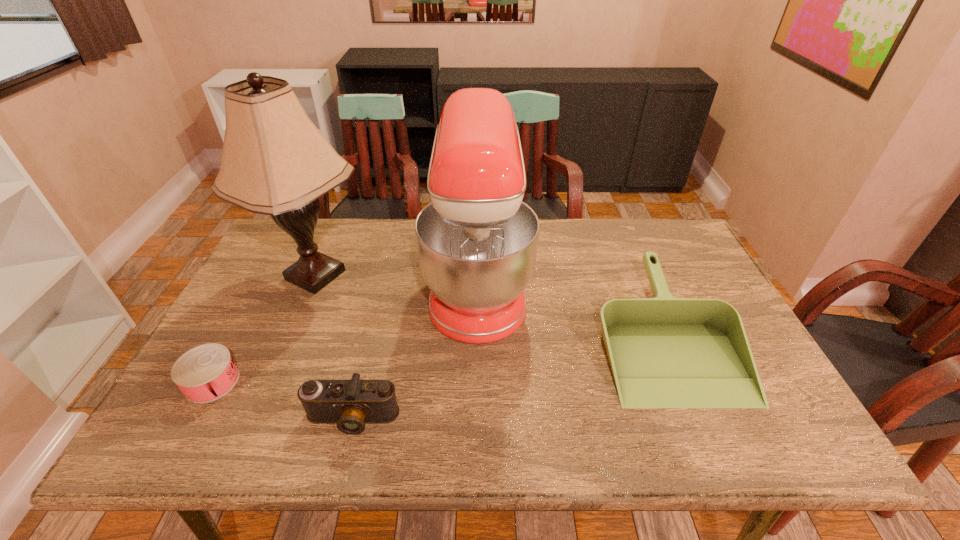
Where is `lamp at the far edge`? lamp at the far edge is located at coordinates (275, 161).

You are a GUI agent. You are given a task and a screenshot of the screen. Output one action in this format:
    pyautogui.click(x=<x>, y=<y>)
    Task: Click on the mixer that is at the far edge
    
    Given the screenshot: What is the action you would take?
    pyautogui.click(x=477, y=242)

Where is `object that is positioned at the near edge`? Image resolution: width=960 pixels, height=540 pixels. object that is positioned at the near edge is located at coordinates (350, 404).

Identify the location of lamp that is at the left edge. (275, 161).

You are a GUI agent. You are given a task and a screenshot of the screen. Output one action in this format:
    pyautogui.click(x=<x>, y=<y>)
    Task: Click on the can at the left edge
    Image resolution: width=960 pixels, height=540 pixels.
    Given the screenshot: What is the action you would take?
    pyautogui.click(x=203, y=374)

Image resolution: width=960 pixels, height=540 pixels. I want to click on object situated at the right edge, so click(664, 352).

Find the location of a particular element. This screenshot has height=540, width=960. object that is positioned at the far left corner is located at coordinates (275, 161).

Locate an element on the screen. vacant space at the far edge of the desktop is located at coordinates (611, 218).

Identify the location of free location at the near edge of the desktop. The width and height of the screenshot is (960, 540). (597, 437).

In the image, there is a desktop. Where is `vacant space at the left edge`? vacant space at the left edge is located at coordinates (269, 336).